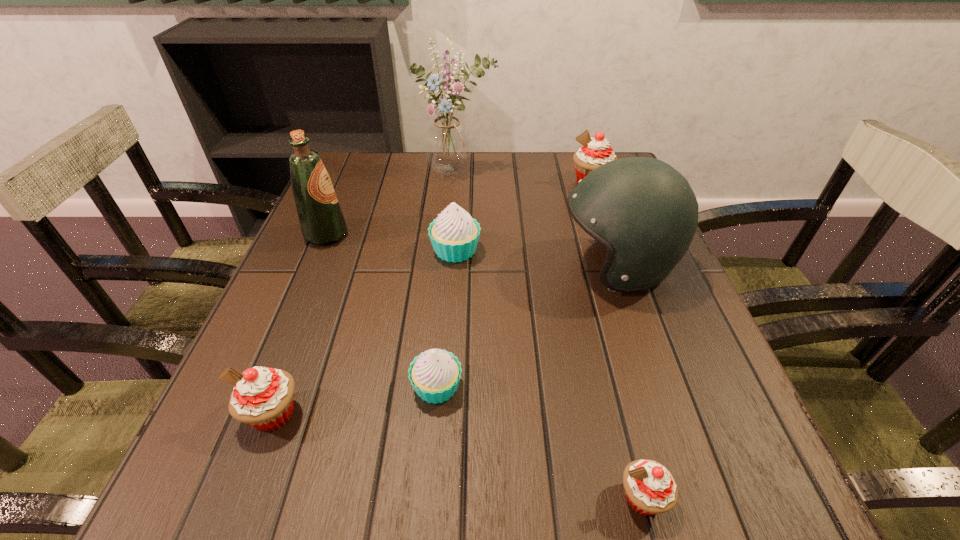
Locate an element on the screen. pink cupcake that stands as the second closest to the smaller white cupcake is located at coordinates (650, 488).

You are a GUI agent. You are given a task and a screenshot of the screen. Output one action in this format:
    pyautogui.click(x=<x>, y=<y>)
    Task: Click on the vacant space that satisfies the following two spatial constraints: 1. on the front-facing side of the tallest object; 2. on the left side of the nearest pink cupcake
    The image size is (960, 540).
    Given the screenshot: What is the action you would take?
    pyautogui.click(x=431, y=498)

Locate an element on the screen. Image resolution: width=960 pixels, height=540 pixels. free region that satisfies the following two spatial constraints: 1. on the front-facing side of the farthest cupcake; 2. on the right side of the bouquet is located at coordinates (456, 182).

At what (x,y) coordinates should I click in order to perform the action: click on free space that satisfies the following two spatial constraints: 1. on the front-facing side of the green olive oil; 2. on the left side of the second farthest pink cupcake. Please return your answer as a coordinate pair (x, y). The width and height of the screenshot is (960, 540). Looking at the image, I should click on (252, 414).

The height and width of the screenshot is (540, 960). What are the coordinates of `free space in the image that satisfies the following two spatial constraints: 1. on the front-facing side of the second farthest cupcake; 2. on the left side of the green bouquet` in the screenshot? It's located at (450, 250).

This screenshot has width=960, height=540. In order to click on free region that satisfies the following two spatial constraints: 1. on the front-facing side of the bouquet; 2. on the front-facing side of the green olive oil in this screenshot , I will do `click(451, 234)`.